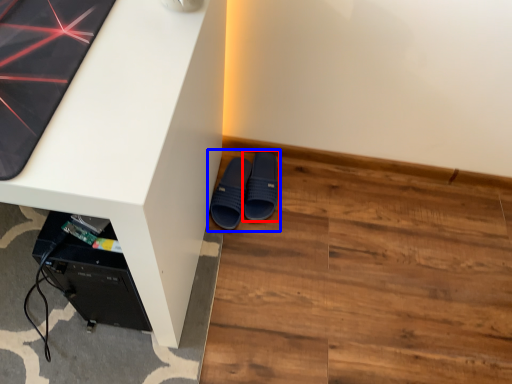
Question: Which object appears farthest to the camera in this image, footwear (highlighted by a red box) or footwear (highlighted by a blue box)?

Choices:
 (A) footwear
 (B) footwear

Answer: (A)